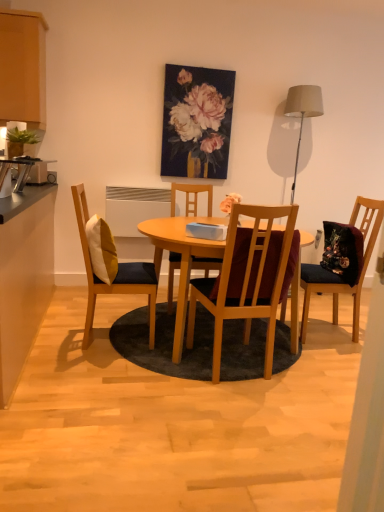
Question: Considering the positions of white plastic radiator at center and light wood table at center in the image, is white plastic radiator at center wider or thinner than light wood table at center?

Choices:
 (A) wide
 (B) thin

Answer: (B)

Question: Relative to light wood table at center, is white plastic radiator at center in front or behind?

Choices:
 (A) behind
 (B) front

Answer: (A)

Question: Which of these objects is positioned farthest from the wooden chair at center, which appears as the second chair when viewed from the left?

Choices:
 (A) matte beige lampshade at upper right
 (B) black laminate countertop at left, marked as the 2th cabinetry in a top-to-bottom arrangement
 (C) light wood table at center
 (D) oil paint canvas at upper center
 (E) yellow and white cushioned chair at left, which appears as the 1th chair when viewed from the left

Answer: (A)

Question: Which is farther from the wooden chair at center, which ranks as the 2th chair in right-to-left order?

Choices:
 (A) black laminate countertop at left, which is the 1th cabinetry from bottom to top
 (B) oil paint canvas at upper center
 (C) velvet dark blue chair at right, the 4th chair positioned from the left
 (D) white plastic radiator at center
 (E) wooden chair at center, which appears as the second chair when viewed from the left

Answer: (C)